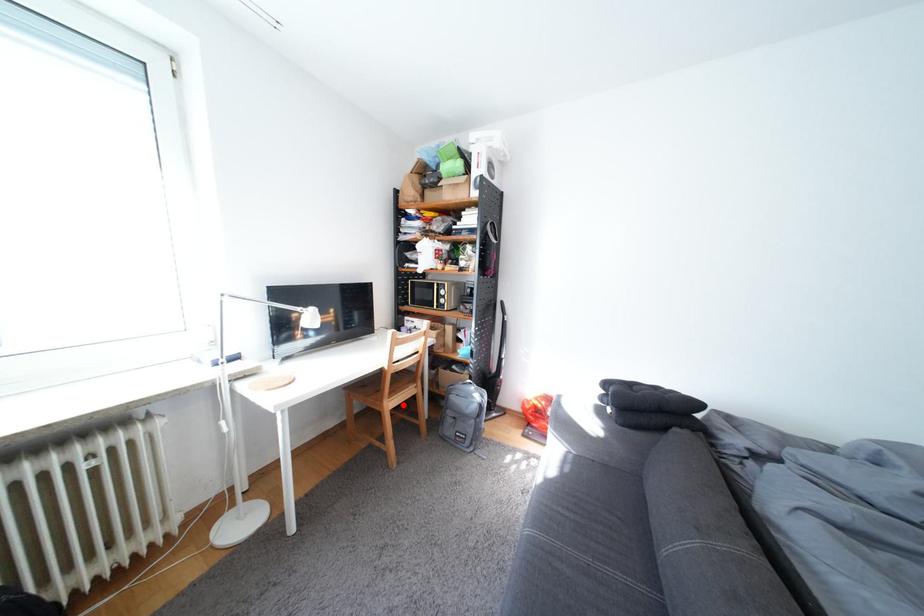
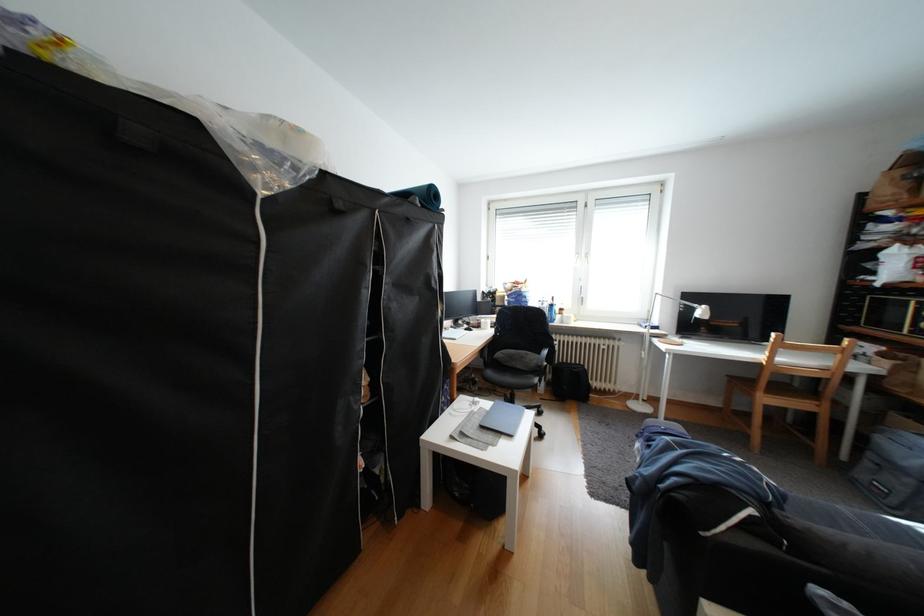
Question: I am providing you with two images of the same scene from different viewpoints. Image1 has a red point marked. In image2, the corresponding 3D location appears at what relative position? Reply with the corresponding letter.

Choices:
 (A) Closer
 (B) Farther

Answer: (A)